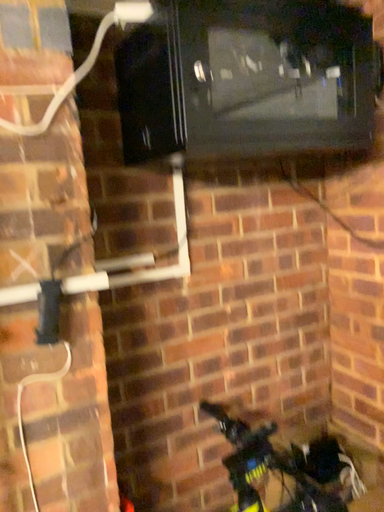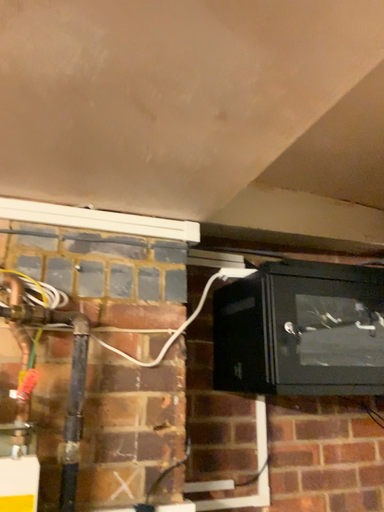
Question: Which way did the camera rotate in the video?

Choices:
 (A) rotated left
 (B) rotated right

Answer: (A)